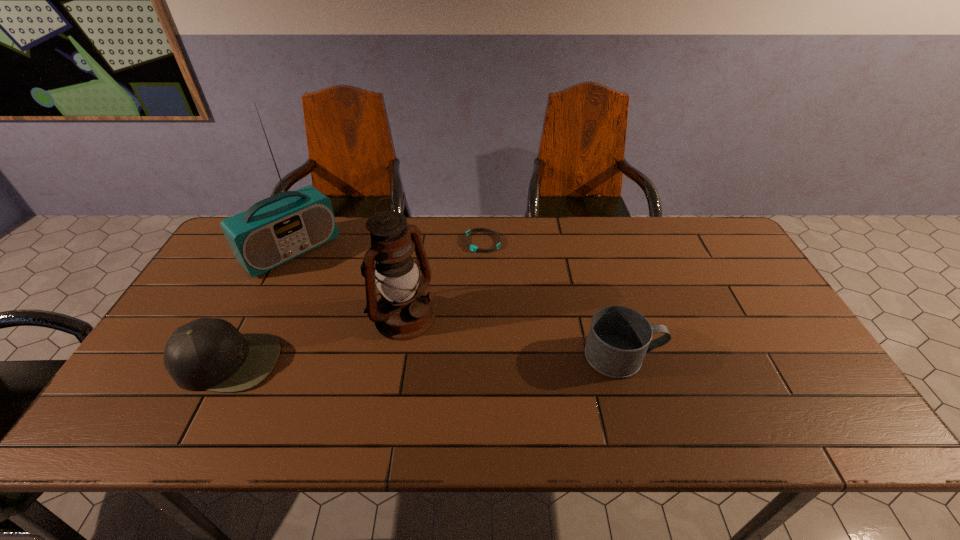
Find the location of a particular element. The image size is (960, 540). mug positioned at the near edge is located at coordinates (619, 338).

The image size is (960, 540). I want to click on cap that is at the left edge, so click(x=210, y=354).

Where is `radio receiver at the left edge`? Image resolution: width=960 pixels, height=540 pixels. radio receiver at the left edge is located at coordinates pos(279,228).

At what (x,y) coordinates should I click in order to perform the action: click on object at the far left corner. Please return your answer as a coordinate pair (x, y). Looking at the image, I should click on (279, 228).

Locate an element on the screen. This screenshot has width=960, height=540. object situated at the near left corner is located at coordinates (210, 354).

Identify the location of vacant region at the far edge of the desktop. (538, 227).

Image resolution: width=960 pixels, height=540 pixels. Identify the location of vacant space at the near edge of the desktop. [756, 401].

This screenshot has width=960, height=540. Find the location of `vacant space at the left edge`. vacant space at the left edge is located at coordinates (256, 279).

Locate an element on the screen. Image resolution: width=960 pixels, height=540 pixels. free space at the right edge of the desktop is located at coordinates (782, 361).

At what (x,y) coordinates should I click in order to perform the action: click on vacant space at the far right corner of the desktop. Please return your answer as a coordinate pair (x, y). Looking at the image, I should click on (688, 250).